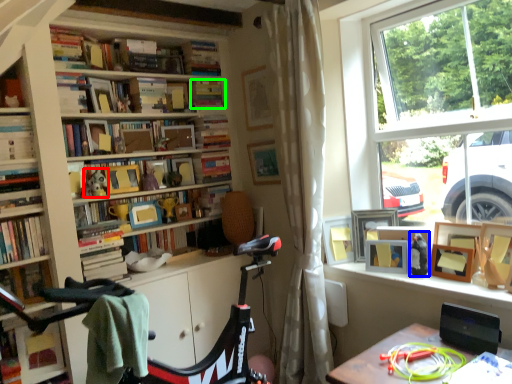
Question: Which object is positioned farthest from toy (highlighted by a red box)? Select from toy (highlighted by a blue box) and book (highlighted by a green box).

Choices:
 (A) toy
 (B) book

Answer: (A)